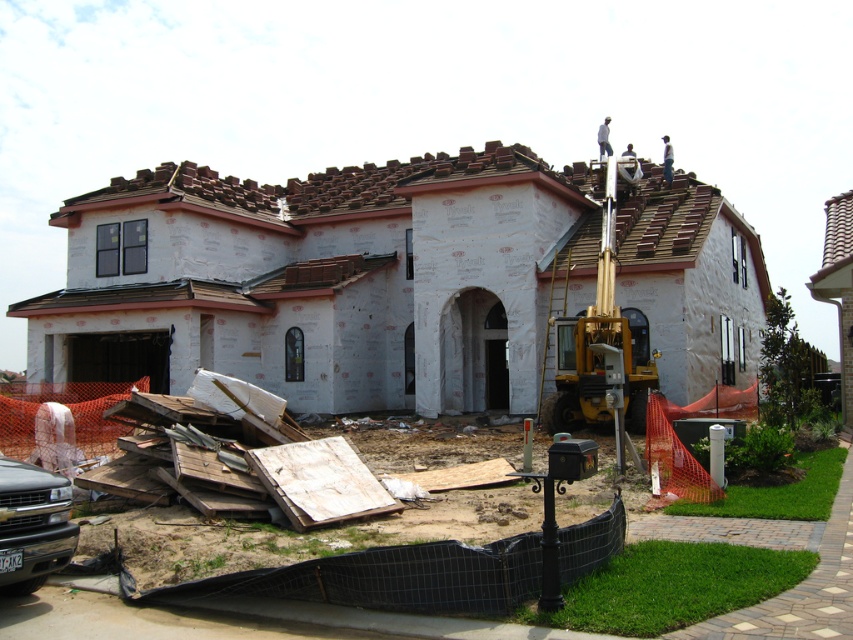
You are a delivery person arriving at the construction site. You need to park your matte black truck at lower left as close as possible to the white foam insulation at lower left. What is the minimum distance you can achieve between them?

The white foam insulation at lower left is 2.28 meters away from the matte black truck at lower left, so the minimum distance you can achieve between them is 2.28 meters.

You are standing in front of the construction site and notice two points marked on the image. The first point is at coordinate point [773,525] and the second point is at coordinate point [0,506]. Which point is closer to you?

Point [0,506] is closer to you because it is closer to the camera than point [773,525].